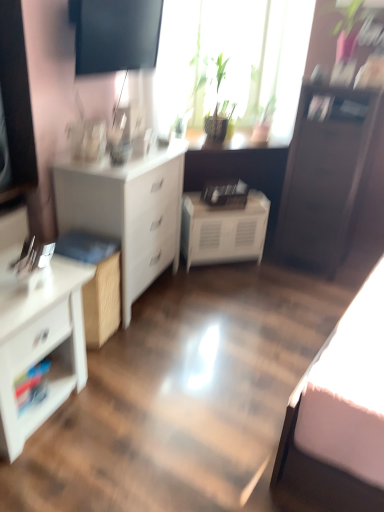
In order to click on vacant region in front of white matte cabinet at center in this screenshot , I will do `click(223, 281)`.